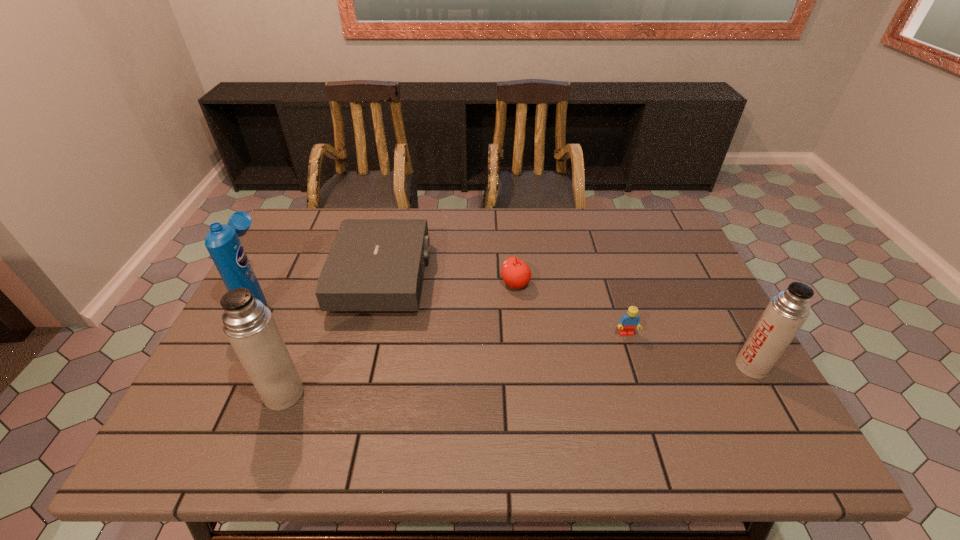
You are a GUI agent. You are given a task and a screenshot of the screen. Output one action in this format:
    pyautogui.click(x=<x>, y=<y>)
    Task: Click on the free region at the far edge of the desktop
    Image resolution: width=960 pixels, height=540 pixels.
    Given the screenshot: What is the action you would take?
    pyautogui.click(x=564, y=215)

At what (x,y) coordinates should I click in order to perform the action: click on vacant area at the near edge of the desktop. Please return your answer as a coordinate pair (x, y). The image size is (960, 540). Looking at the image, I should click on (329, 400).

The height and width of the screenshot is (540, 960). Find the location of `free region at the left edge`. free region at the left edge is located at coordinates (303, 271).

I want to click on free space at the right edge of the desktop, so click(x=674, y=345).

The image size is (960, 540). I want to click on vacant space at the far left corner, so click(299, 231).

In the image, there is a desktop. Identify the location of vacant space at the near left corner. (228, 389).

Find the location of a particular element. The image size is (960, 540). vacant area between the projector and the taller thermos bottle is located at coordinates (333, 335).

Image resolution: width=960 pixels, height=540 pixels. What are the coordinates of `free space between the Lego and the leftmost object` in the screenshot? It's located at (443, 317).

At what (x,y) coordinates should I click in order to perform the action: click on free point between the shampoo and the third nearest object. Please return your answer as a coordinate pair (x, y). Looking at the image, I should click on (443, 317).

Find the location of a particular element. The image size is (960, 540). free space between the shorter thermos bottle and the projector is located at coordinates coord(567,322).